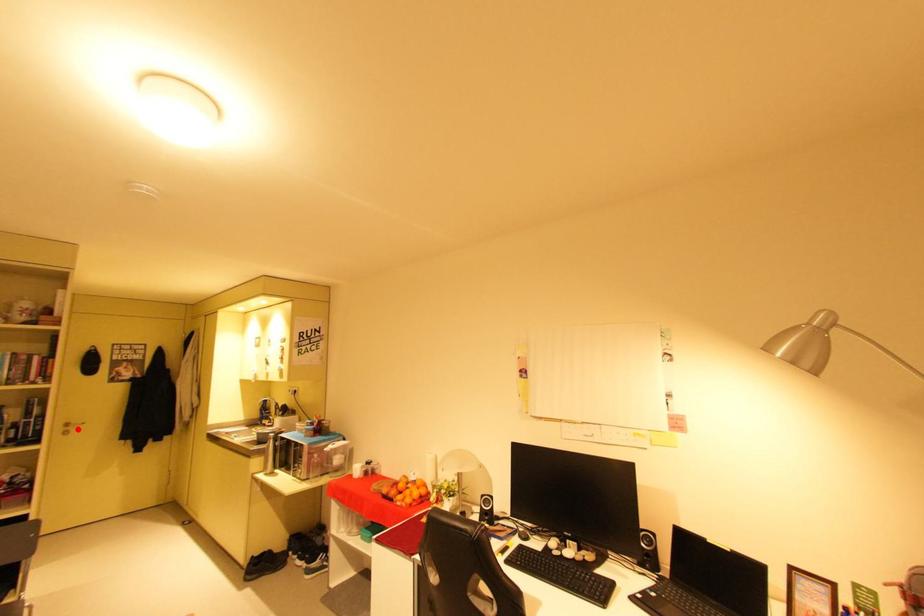
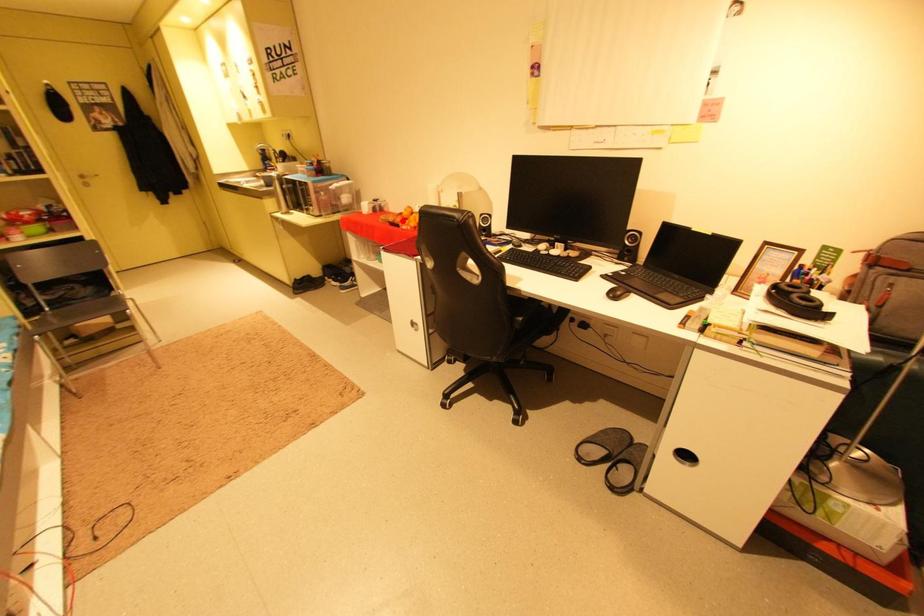
I am providing you with two images of the same scene from different viewpoints. A red point is marked on the first image and another point is marked on the second image. Is the marked point in image1 the same physical position as the marked point in image2?

No